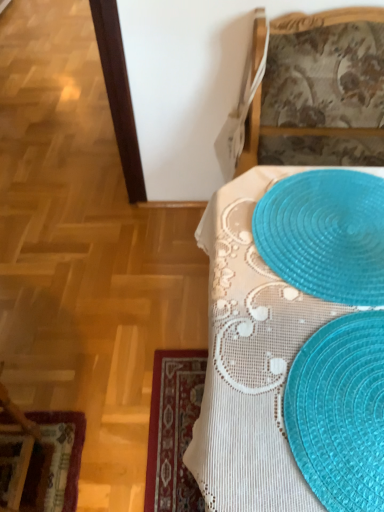
Describe the element at coordinates (250, 360) in the screenshot. I see `translucent plastic placemats at lower right` at that location.

Where is `translucent plastic placemats at lower right`? translucent plastic placemats at lower right is located at coordinates (250, 360).

Identify the location of translucent blue placemat at lower right. The height and width of the screenshot is (512, 384). (340, 412).

You are a GUI agent. You are given a task and a screenshot of the screen. Output one action in this format:
    pyautogui.click(x=<x>, y=<y>)
    Task: Click on the velvet burgundy placemat at lower left
    Image resolution: width=384 pixels, height=512 pixels.
    Given the screenshot: What is the action you would take?
    pyautogui.click(x=55, y=462)

Does translucent plastic placemat at upper right appear on the right side of velvet burgundy placemat at lower left?

Yes.

Identify the location of place mat on the left of translucent plastic placemat at upper right. The width and height of the screenshot is (384, 512). (55, 462).

From the image's perspective, does translucent plastic placemat at upper right appear lower than velvet burgundy placemat at lower left?

No.

Is translucent plastic placemat at upper right oriented towards velvet burgundy placemat at lower left?

No, translucent plastic placemat at upper right is not turned towards velvet burgundy placemat at lower left.

Which is correct: velvet burgundy placemat at lower left is inside translucent plastic placemats at lower right, or outside of it?

velvet burgundy placemat at lower left is not enclosed by translucent plastic placemats at lower right.

From a real-world perspective, is velvet burgundy placemat at lower left on top of translucent plastic placemats at lower right?

Incorrect, from a real-world perspective, velvet burgundy placemat at lower left is lower than translucent plastic placemats at lower right.

Based on the photo, from the image's perspective, which object appears higher, velvet burgundy placemat at lower left or translucent plastic placemats at lower right?

translucent plastic placemats at lower right, from the image's perspective.

Is velvet burgundy placemat at lower left in front of or behind translucent plastic placemats at lower right in the image?

Visually, velvet burgundy placemat at lower left is located behind translucent plastic placemats at lower right.

Measure the distance between translucent blue placemat at lower right and velvet burgundy placemat at lower left.

They are 37.72 inches apart.

Could you tell me if translucent blue placemat at lower right is turned towards velvet burgundy placemat at lower left?

No.

Identify the location of place mat located below the translucent blue placemat at lower right (from the image's perspective). The image size is (384, 512). (55, 462).

Consider the image. From the image's perspective, is translucent blue placemat at lower right under velvet burgundy placemat at lower left?

No, from the image's perspective, translucent blue placemat at lower right is not beneath velvet burgundy placemat at lower left.

From a real-world perspective, is translucent plastic placemats at lower right physically below translucent plastic placemat at upper right?

Yes.

From the image's perspective, between translucent plastic placemats at lower right and translucent plastic placemat at upper right, who is located below?

From the image's view, translucent plastic placemats at lower right is below.

Is translucent plastic placemats at lower right oriented towards translucent plastic placemat at upper right?

No, translucent plastic placemats at lower right does not turn towards translucent plastic placemat at upper right.

Is translucent plastic placemats at lower right not near translucent plastic placemat at upper right?

Actually, translucent plastic placemats at lower right and translucent plastic placemat at upper right are a little close together.

Which is more to the left, translucent plastic placemat at upper right or translucent plastic placemat at upper right?

translucent plastic placemat at upper right is more to the left.

Considering the sizes of translucent plastic placemat at upper right and translucent plastic placemat at upper right in the image, is translucent plastic placemat at upper right wider or thinner than translucent plastic placemat at upper right?

translucent plastic placemat at upper right is thinner than translucent plastic placemat at upper right.

How different are the orientations of translucent plastic placemat at upper right and translucent plastic placemat at upper right in degrees?

There is a 87.4-degree angle between the facing directions of translucent plastic placemat at upper right and translucent plastic placemat at upper right.

Is translucent plastic placemat at upper right turned away from translucent plastic placemat at upper right?

No, translucent plastic placemat at upper right's orientation is not away from translucent plastic placemat at upper right.

Considering the positions of objects translucent plastic placemat at upper right and translucent blue placemat at lower right in the image provided, who is in front, translucent plastic placemat at upper right or translucent blue placemat at lower right?

Positioned in front is translucent blue placemat at lower right.

Does translucent plastic placemat at upper right have a larger size compared to translucent blue placemat at lower right?

Yes, translucent plastic placemat at upper right is bigger than translucent blue placemat at lower right.

The height and width of the screenshot is (512, 384). I want to click on straw hat above the translucent plastic placemat at upper right (from a real-world perspective), so click(x=340, y=412).

Based on their positions, is translucent plastic placemat at upper right located to the left or right of translucent blue placemat at lower right?

translucent plastic placemat at upper right is to the right of translucent blue placemat at lower right.

Does translucent plastic placemats at lower right have a lesser width compared to translucent plastic placemat at upper right?

In fact, translucent plastic placemats at lower right might be wider than translucent plastic placemat at upper right.

Is translucent plastic placemats at lower right behind translucent plastic placemat at upper right?

No, it is in front of translucent plastic placemat at upper right.

Find the location of a particular element. table below the translucent plastic placemat at upper right (from the image's perspective) is located at coordinates (250, 360).

Is translucent plastic placemats at lower right oriented towards translucent plastic placemat at upper right?

No.

You are a GUI agent. You are given a task and a screenshot of the screen. Output one action in this format:
    pyautogui.click(x=<x>, y=<y>)
    Task: Click on the furniture that is in front of the velvet burgundy placemat at lower left
    The height and width of the screenshot is (512, 384).
    Given the screenshot: What is the action you would take?
    pyautogui.click(x=280, y=75)

Image resolution: width=384 pixels, height=512 pixels. I want to click on table that appears above the velvet burgundy placemat at lower left (from the image's perspective), so click(x=250, y=360).

From the image, which object appears to be farther from translucent plastic placemat at upper right, translucent plastic placemat at upper right or velvet burgundy placemat at lower left?

The object further to translucent plastic placemat at upper right is velvet burgundy placemat at lower left.

Consider the image. From the image, which object appears to be nearer to translucent blue placemat at lower right, translucent plastic placemats at lower right or translucent plastic placemat at upper right?

Based on the image, translucent plastic placemats at lower right appears to be nearer to translucent blue placemat at lower right.

In the scene shown: Based on their spatial positions, is translucent plastic placemats at lower right or translucent blue placemat at lower right closer to translucent plastic placemat at upper right?

The object closer to translucent plastic placemat at upper right is translucent plastic placemats at lower right.

When comparing their distances from translucent plastic placemats at lower right, does translucent plastic placemat at upper right or translucent blue placemat at lower right seem further?

The object further to translucent plastic placemats at lower right is translucent blue placemat at lower right.

In the scene shown: Looking at the image, which one is located closer to translucent blue placemat at lower right, velvet burgundy placemat at lower left or translucent plastic placemat at upper right?

Based on the image, translucent plastic placemat at upper right appears to be nearer to translucent blue placemat at lower right.

Looking at the image, which one is located further to translucent blue placemat at lower right, translucent plastic placemat at upper right or velvet burgundy placemat at lower left?

translucent plastic placemat at upper right is positioned further to the anchor translucent blue placemat at lower right.

When comparing their distances from translucent plastic placemat at upper right, does translucent blue placemat at lower right or velvet burgundy placemat at lower left seem further?

velvet burgundy placemat at lower left.

Estimate the real-world distances between objects in this image. Which object is further from translucent plastic placemat at upper right, translucent plastic placemats at lower right or velvet burgundy placemat at lower left?

Among the two, velvet burgundy placemat at lower left is located further to translucent plastic placemat at upper right.

Find the location of a particular element. This screenshot has height=512, width=384. straw hat between velvet burgundy placemat at lower left and translucent plastic placemat at upper right in the horizontal direction is located at coordinates (340, 412).

Find the location of `table located between velvet burgundy placemat at lower left and translucent plastic placemat at upper right in the left-right direction`. table located between velvet burgundy placemat at lower left and translucent plastic placemat at upper right in the left-right direction is located at coordinates (250, 360).

Image resolution: width=384 pixels, height=512 pixels. Identify the location of table located between velvet burgundy placemat at lower left and translucent blue placemat at lower right in the left-right direction. (x=250, y=360).

Find the location of a particular element. table between translucent plastic placemat at upper right and translucent blue placemat at lower right in the vertical direction is located at coordinates (250, 360).